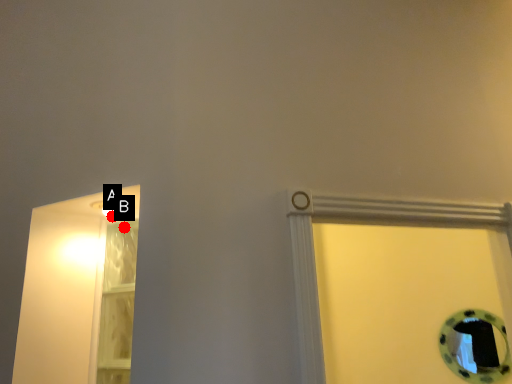
Question: Two points are circled on the image, labeled by A and B beside each circle. Which point is closer to the camera?

Choices:
 (A) A is closer
 (B) B is closer

Answer: (A)